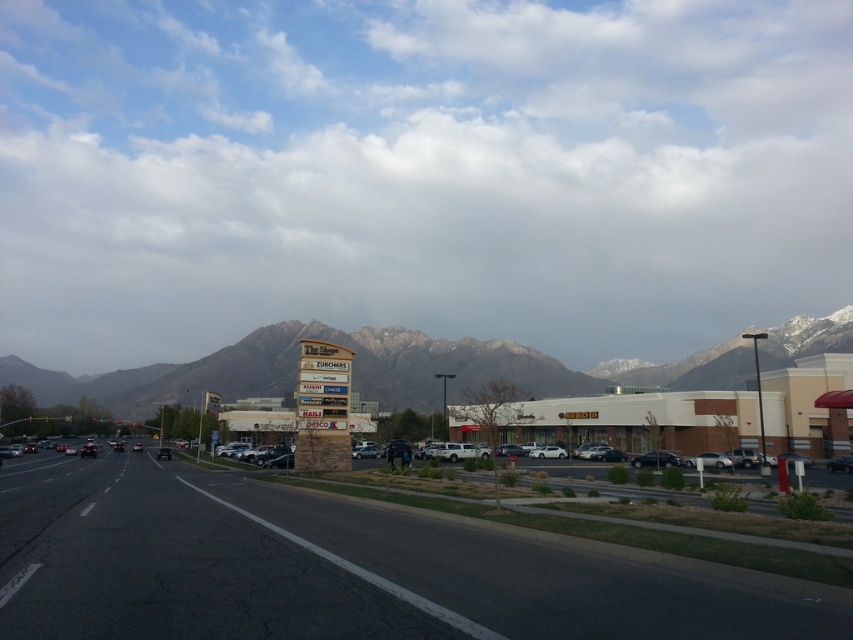
Question: Which point appears closest to the camera in this image?

Choices:
 (A) (27, 385)
 (B) (795, 180)

Answer: (A)

Question: Does white fluffy cloud at upper center lie in front of rocky mountain range at center?

Choices:
 (A) yes
 (B) no

Answer: (B)

Question: Does white fluffy cloud at upper center lie in front of rocky mountain range at center?

Choices:
 (A) yes
 (B) no

Answer: (B)

Question: Which point is closer to the camera taking this photo?

Choices:
 (A) (131, 164)
 (B) (254, 358)

Answer: (B)

Question: Is white fluffy cloud at upper center to the left of rocky mountain range at center from the viewer's perspective?

Choices:
 (A) yes
 (B) no

Answer: (A)